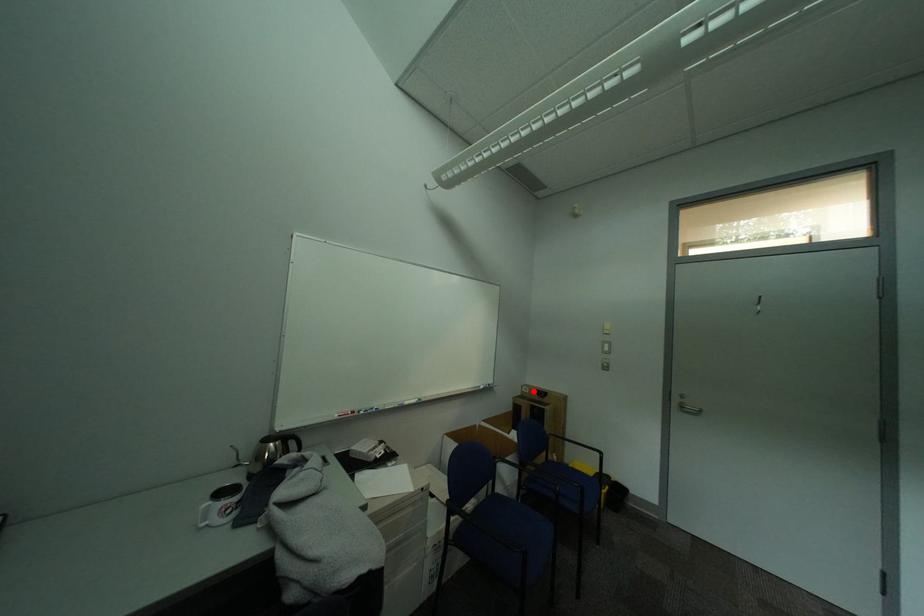
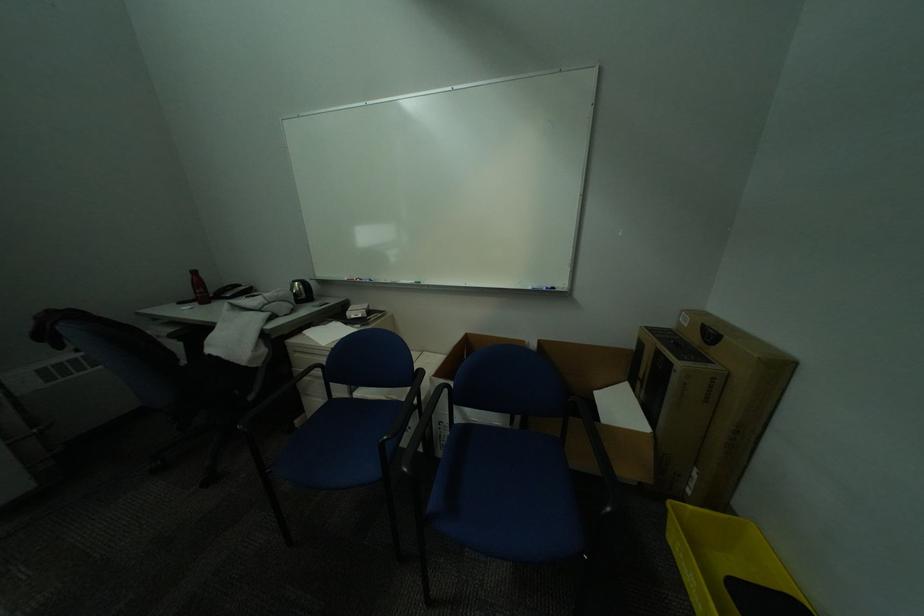
The point at the highlighted location is marked in the first image. Where is the corresponding point in the second image?

(691, 321)